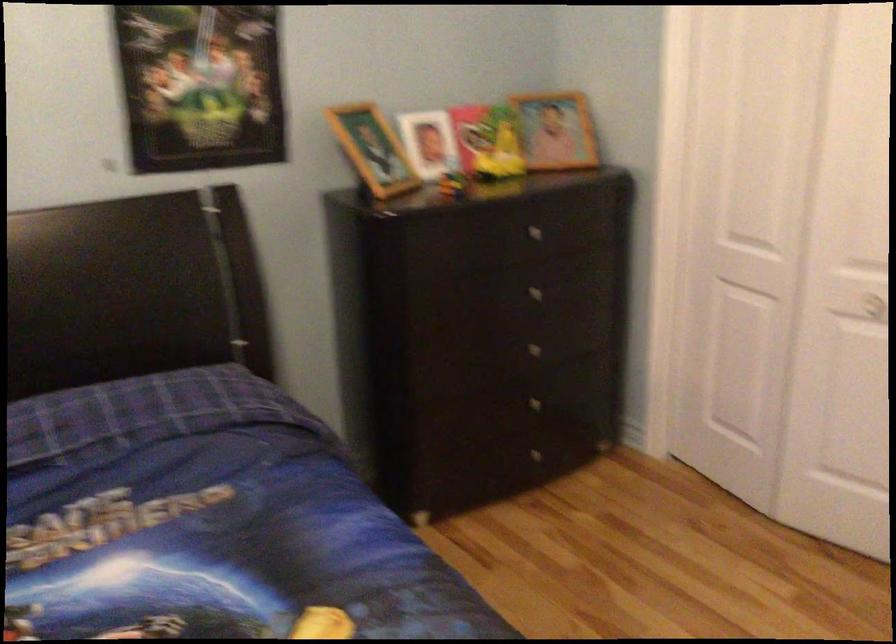
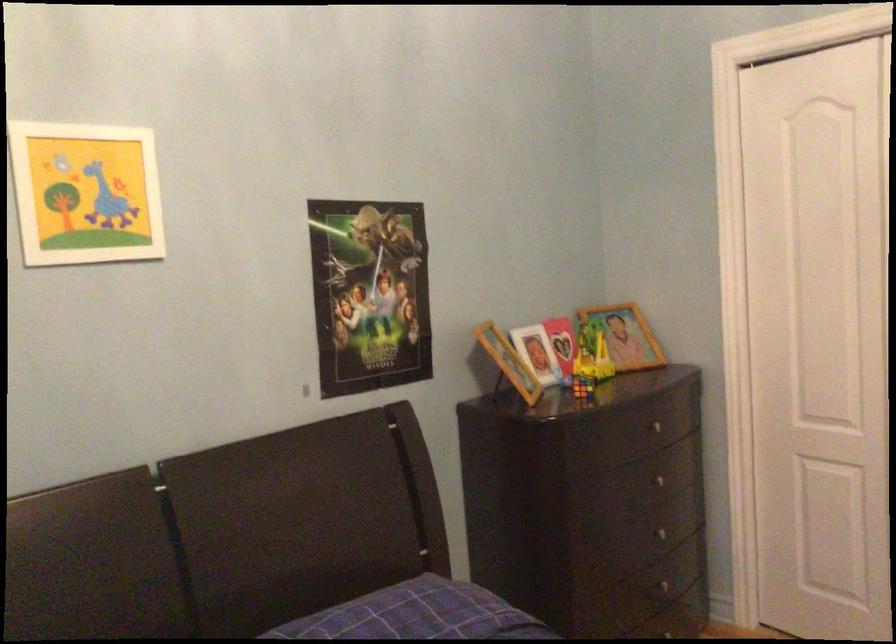
The point at (449, 178) is marked in the first image. Where is the corresponding point in the second image?

(582, 386)